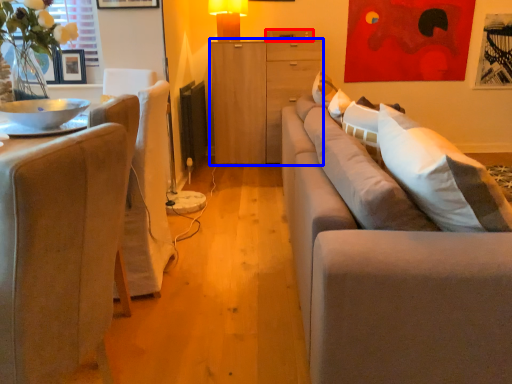
Question: Which object appears closest to the camera in this image, drawer (highlighted by a red box) or cabinetry (highlighted by a blue box)?

Choices:
 (A) drawer
 (B) cabinetry

Answer: (B)